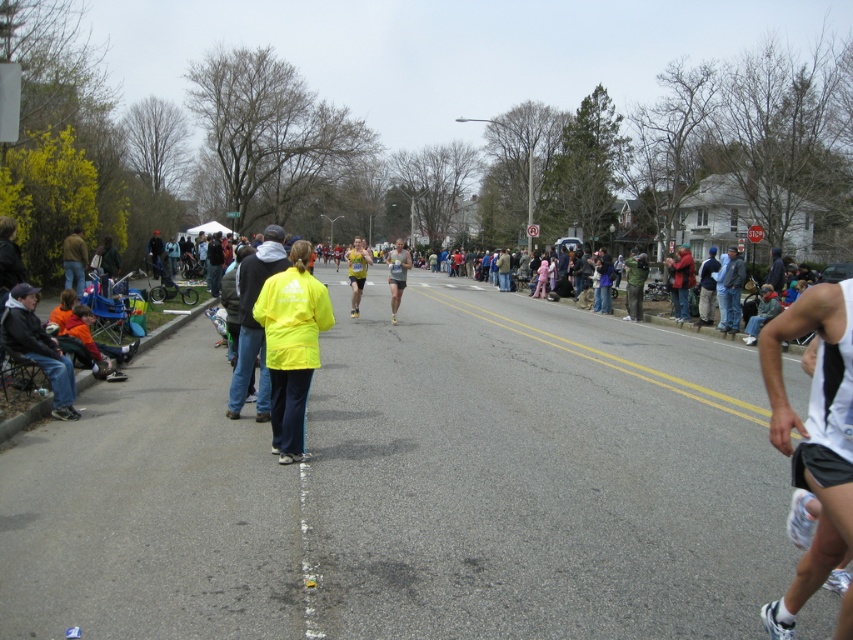
Question: Observing the image, what is the correct spatial positioning of dark blue denim jacket at lower left in reference to matte yellow jacket at center?

Choices:
 (A) left
 (B) right

Answer: (A)

Question: Does yellow fabric jacket at center lie in front of dark gray clothing at right?

Choices:
 (A) yes
 (B) no

Answer: (B)

Question: Estimate the real-world distances between objects in this image. Which object is farther from the white athletic shorts at center?

Choices:
 (A) yellow matte jacket at center
 (B) jeans at left

Answer: (B)

Question: Which of the following is the farthest from the observer?

Choices:
 (A) yellow fabric jacket at center
 (B) neon yellow jacket at center
 (C) matte yellow jacket at center

Answer: (C)

Question: Considering the real-world distances, which object is farthest from the matte yellow jacket at center?

Choices:
 (A) jeans at left
 (B) dark gray clothing at right

Answer: (B)

Question: Does dark blue denim jacket at lower left come behind jeans at left?

Choices:
 (A) yes
 (B) no

Answer: (B)